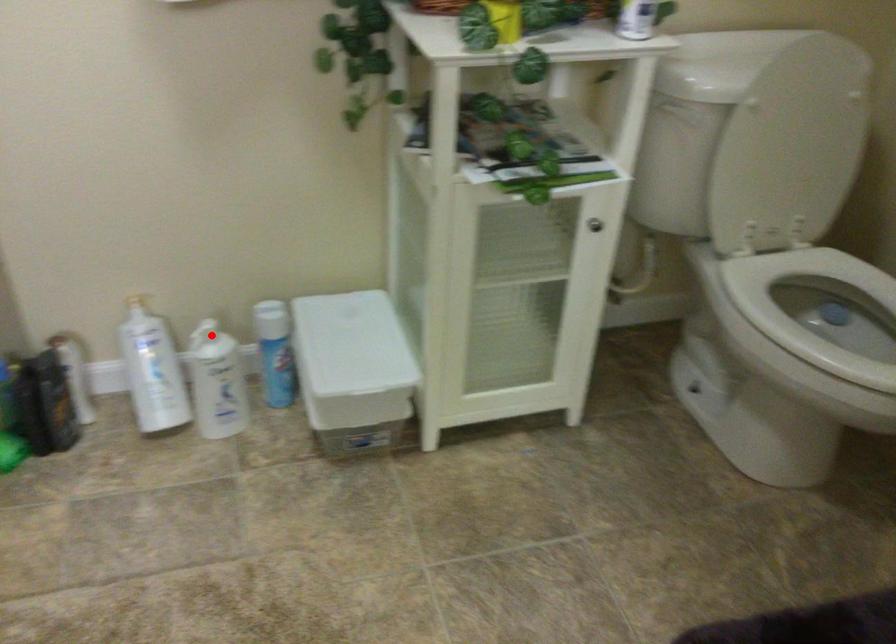
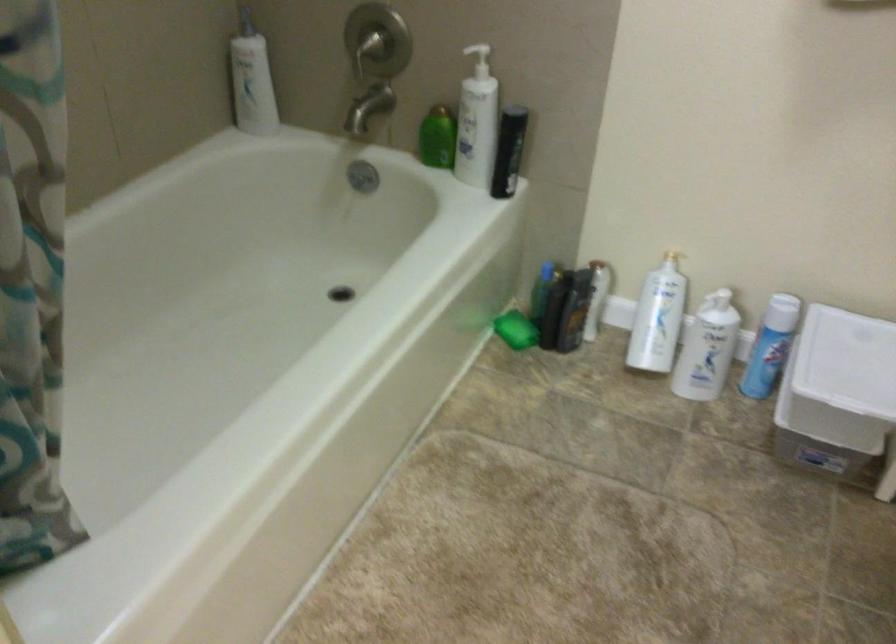
Question: I am providing you with two images of the same scene from different viewpoints. A red point is marked on the first image. At the location where the point appears in image 1, is it still visible in image 2?

Choices:
 (A) Yes
 (B) No

Answer: (A)